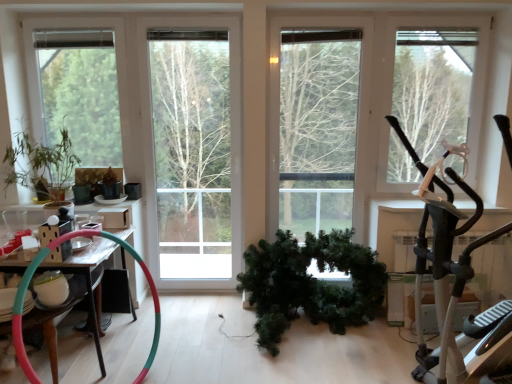
Describe the element at coordinates (87, 272) in the screenshot. I see `wooden table at left` at that location.

What is the approximate height of green matte plant at left, which is the third tree in right-to-left order?

green matte plant at left, which is the third tree in right-to-left order, is 1.32 meters in height.

At what (x,y) coordinates should I click in order to perform the action: click on green matte wreath at center, which appears as the 1th houseplant when ordered from the bottom. Please return your answer as a coordinate pair (x, y). Looking at the image, I should click on (311, 283).

How much space does green matte wreath at center, positioned as the 2th houseplant in top-to-bottom order, occupy horizontally?

green matte wreath at center, positioned as the 2th houseplant in top-to-bottom order, is 36.03 inches wide.

At what (x,y) coordinates should I click in order to perform the action: click on metallic gray stationary bicycle at right. Please return your answer as a coordinate pair (x, y). Looking at the image, I should click on [442, 253].

Looking at their sizes, would you say green matte tree at center, the 2th tree in the left-to-right sequence, is wider or thinner than green matte wreath at center, the 1th houseplant in the right-to-left sequence?

green matte tree at center, the 2th tree in the left-to-right sequence, is thinner than green matte wreath at center, the 1th houseplant in the right-to-left sequence.

Is green matte tree at center, the 2th tree in the left-to-right sequence, closer to camera compared to green matte wreath at center, the 1th houseplant in the right-to-left sequence?

No, the depth of green matte tree at center, the 2th tree in the left-to-right sequence, is greater than that of green matte wreath at center, the 1th houseplant in the right-to-left sequence.

Does green matte tree at center, which is the 2th tree from right to left, have a greater height compared to green matte wreath at center, which is counted as the 2th houseplant, starting from the left?

Correct, green matte tree at center, which is the 2th tree from right to left, is much taller as green matte wreath at center, which is counted as the 2th houseplant, starting from the left.

Which is behind, point (164, 222) or point (340, 318)?

The point (164, 222) is farther from the camera.

From a real-world perspective, is metallic gray stationary bicycle at right positioned under green matte plant at left, which is the third tree in right-to-left order, based on gravity?

Yes, from a real-world perspective, metallic gray stationary bicycle at right is under green matte plant at left, which is the third tree in right-to-left order.

In the scene shown: In terms of height, does metallic gray stationary bicycle at right look taller or shorter compared to green matte plant at left, acting as the first tree starting from the left?

Considering their sizes, metallic gray stationary bicycle at right has more height than green matte plant at left, acting as the first tree starting from the left.

Does metallic gray stationary bicycle at right turn towards green matte plant at left, which is the third tree in right-to-left order?

No, metallic gray stationary bicycle at right is not turned towards green matte plant at left, which is the third tree in right-to-left order.

Between metallic gray stationary bicycle at right and green matte plant at left, acting as the first tree starting from the left, which one is positioned behind?

green matte plant at left, acting as the first tree starting from the left, is more distant.

Does green matte tree at center, which is the 2th tree from right to left, have a larger size compared to green matte tree at right, which is the first tree from right to left?

Correct, green matte tree at center, which is the 2th tree from right to left, is larger in size than green matte tree at right, which is the first tree from right to left.

Is green matte tree at center, the 2th tree in the left-to-right sequence, not near green matte tree at right, which is the first tree from right to left?

Indeed, green matte tree at center, the 2th tree in the left-to-right sequence, is not near green matte tree at right, which is the first tree from right to left.

Measure the distance from green matte tree at center, which is the 2th tree from right to left, to green matte tree at right, positioned as the third tree in left-to-right order.

green matte tree at center, which is the 2th tree from right to left, is 5.60 feet away from green matte tree at right, positioned as the third tree in left-to-right order.

What's the angular difference between green matte tree at center, which is the 2th tree from right to left, and green matte tree at right, which is the first tree from right to left,'s facing directions?

The angular difference between green matte tree at center, which is the 2th tree from right to left, and green matte tree at right, which is the first tree from right to left, is 0.827 degrees.

Does wooden table at left appear on the right side of green matte tree at center, which is the 2th tree from right to left?

In fact, wooden table at left is to the left of green matte tree at center, which is the 2th tree from right to left.

In order to click on table lying on the left of green matte tree at center, the 2th tree in the left-to-right sequence in this screenshot , I will do `click(87, 272)`.

Is wooden table at left facing towards green matte tree at center, the 2th tree in the left-to-right sequence?

No, wooden table at left is not aimed at green matte tree at center, the 2th tree in the left-to-right sequence.

Are green matte tree at center, which is the 2th tree from right to left, and metallic gray stationary bicycle at right beside each other?

No, green matte tree at center, which is the 2th tree from right to left, is not touching metallic gray stationary bicycle at right.

Is green matte tree at center, the 2th tree in the left-to-right sequence, oriented away from metallic gray stationary bicycle at right?

No, green matte tree at center, the 2th tree in the left-to-right sequence,'s orientation is not away from metallic gray stationary bicycle at right.

How different are the orientations of green matte tree at center, which is the 2th tree from right to left, and metallic gray stationary bicycle at right in degrees?

They differ by 69.8 degrees in their facing directions.

Is green matte wreath at center, which appears as the 1th houseplant when ordered from the bottom, in contact with green matte tree at right, positioned as the third tree in left-to-right order?

green matte wreath at center, which appears as the 1th houseplant when ordered from the bottom, and green matte tree at right, positioned as the third tree in left-to-right order, are not in contact.

From the image's perspective, is green matte wreath at center, positioned as the 2th houseplant in top-to-bottom order, above or below green matte tree at right, positioned as the third tree in left-to-right order?

green matte wreath at center, positioned as the 2th houseplant in top-to-bottom order, is situated lower than green matte tree at right, positioned as the third tree in left-to-right order, in the image.

Which is less distant, (x=282, y=285) or (x=463, y=113)?

The point (x=282, y=285) is closer to the camera.

From a real-world perspective, does green matte wreath at center, which appears as the 1th houseplant when ordered from the bottom, stand above green matte tree at right, which is the first tree from right to left?

Actually, green matte wreath at center, which appears as the 1th houseplant when ordered from the bottom, is physically below green matte tree at right, which is the first tree from right to left, in the real world.

Which is more to the left, metallic gray stationary bicycle at right or green matte wreath at center, which appears as the 1th houseplant when ordered from the bottom?

Positioned to the left is green matte wreath at center, which appears as the 1th houseplant when ordered from the bottom.

Does point (424, 237) lie behind point (292, 309)?

No, (424, 237) is closer to viewer.

Based on the photo, considering the sizes of metallic gray stationary bicycle at right and green matte wreath at center, which is counted as the 2th houseplant, starting from the left, in the image, is metallic gray stationary bicycle at right bigger or smaller than green matte wreath at center, which is counted as the 2th houseplant, starting from the left,?

Clearly, metallic gray stationary bicycle at right is larger in size than green matte wreath at center, which is counted as the 2th houseplant, starting from the left.

The height and width of the screenshot is (384, 512). What are the coordinates of `houseplant on the right of green matte tree at center, the 2th tree in the left-to-right sequence` in the screenshot? It's located at (311, 283).

Which tree is the 3rd one when counting from the back of the metallic gray stationary bicycle at right? Please provide its 2D coordinates.

[(82, 102)]

Considering their positions, is green matte plant at left, acting as the first tree starting from the left, positioned further to green matte tree at center, which is the 2th tree from right to left, than metallic gray stationary bicycle at right?

The object further to green matte tree at center, which is the 2th tree from right to left, is metallic gray stationary bicycle at right.

Looking at the image, which one is located further to wooden table at left, green matte plant at left, acting as the first tree starting from the left, or green matte plant at left, which is the 1th houseplant from top to bottom?

Among the two, green matte plant at left, acting as the first tree starting from the left, is located further to wooden table at left.

From the image, which object appears to be farther from green matte plant at left, which is the 1th houseplant from top to bottom, green matte plant at left, which is the third tree in right-to-left order, or metallic gray stationary bicycle at right?

Based on the image, metallic gray stationary bicycle at right appears to be further to green matte plant at left, which is the 1th houseplant from top to bottom.

From the image, which object appears to be nearer to wooden table at left, green matte wreath at center, which is counted as the 2th houseplant, starting from the left, or green matte tree at right, positioned as the third tree in left-to-right order?

green matte wreath at center, which is counted as the 2th houseplant, starting from the left.

Estimate the real-world distances between objects in this image. Which object is closer to green matte tree at center, the 2th tree in the left-to-right sequence, green matte plant at left, acting as the second houseplant starting from the right, or wooden table at left?

green matte plant at left, acting as the second houseplant starting from the right, lies closer to green matte tree at center, the 2th tree in the left-to-right sequence, than the other object.

Based on the photo, when comparing their distances from green matte tree at center, the 2th tree in the left-to-right sequence, does green matte plant at left, acting as the first tree starting from the left, or green matte plant at left, the second houseplant ordered from the bottom, seem further?

green matte plant at left, the second houseplant ordered from the bottom.

Considering their positions, is metallic gray stationary bicycle at right positioned closer to green matte wreath at center, which appears as the 1th houseplant when ordered from the bottom, than green matte plant at left, acting as the first tree starting from the left?

metallic gray stationary bicycle at right.

Looking at the image, which one is located closer to green matte plant at left, acting as the first tree starting from the left, green matte tree at center, the 2th tree in the left-to-right sequence, or metallic gray stationary bicycle at right?

green matte tree at center, the 2th tree in the left-to-right sequence.

This screenshot has height=384, width=512. In order to click on houseplant between green matte plant at left, which is the 1th houseplant from top to bottom, and green matte tree at right, which is the first tree from right to left, from left to right in this screenshot , I will do `click(311, 283)`.

Identify the location of table between green matte plant at left, which is the third tree in right-to-left order, and green matte tree at right, positioned as the third tree in left-to-right order, from left to right. (87, 272).

Locate an element on the screen. The width and height of the screenshot is (512, 384). stationary bicycle between green matte plant at left, acting as the second houseplant starting from the right, and green matte tree at right, positioned as the third tree in left-to-right order is located at coordinates (442, 253).

I want to click on stationary bicycle situated between green matte tree at center, the 2th tree in the left-to-right sequence, and green matte tree at right, positioned as the third tree in left-to-right order, from left to right, so click(442, 253).